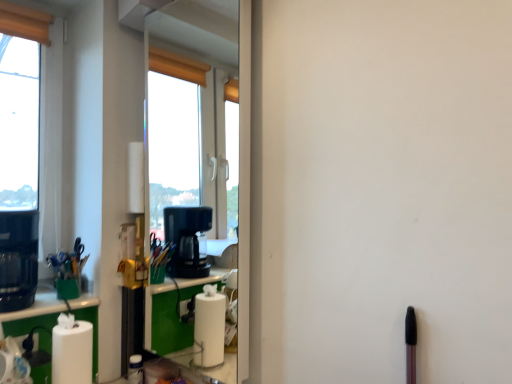
Image resolution: width=512 pixels, height=384 pixels. I want to click on black plastic coffee machine at left, so click(18, 259).

Describe the element at coordinates (29, 152) in the screenshot. I see `white matte window at left` at that location.

Where is `green matte cup at left`? The image size is (512, 384). green matte cup at left is located at coordinates (68, 271).

Is green matte cup at left beside black plastic coffee machine at left?

No, green matte cup at left is not touching black plastic coffee machine at left.

Based on their positions, is green matte cup at left located to the left or right of black plastic coffee machine at left?

Clearly, green matte cup at left is on the right of black plastic coffee machine at left in the image.

Find the location of a particular element. The height and width of the screenshot is (384, 512). stationery that appears behind the black plastic coffee machine at left is located at coordinates (68, 271).

Relative to black plastic coffee machine at left, is green matte cup at left in front or behind?

In the image, green matte cup at left appears behind black plastic coffee machine at left.

Are black plastic coffee machine at left and green matte cup at left located far from each other?

black plastic coffee machine at left is actually quite close to green matte cup at left.

Do you think black plastic coffee machine at left is within green matte cup at left, or outside of it?

black plastic coffee machine at left is spatially situated outside green matte cup at left.

From the image's perspective, does black plastic coffee machine at left appear lower than green matte cup at left?

Incorrect, from the image's perspective, black plastic coffee machine at left is higher than green matte cup at left.

Are white matte paper towel at lower left and green matte cup at left beside each other?

No, white matte paper towel at lower left is not with green matte cup at left.

From a real-world perspective, between white matte paper towel at lower left and green matte cup at left, who is vertically higher?

In real-world perspective, green matte cup at left is above.

Would you say white matte paper towel at lower left contains green matte cup at left?

No.

In the image, there is a green matte cup at left. What are the coordinates of `paper towel below it (from a real-world perspective)` in the screenshot? It's located at pyautogui.click(x=72, y=354).

The width and height of the screenshot is (512, 384). In the image, there is a white matte window at left. In order to click on coffee machine below it (from the image's perspective) in this screenshot , I will do pos(18,259).

From a real-world perspective, is black plastic coffee machine at left positioned over white matte window at left based on gravity?

No, from a real-world perspective, black plastic coffee machine at left is not above white matte window at left.

Is black plastic coffee machine at left positioned before white matte window at left?

Yes, the depth of black plastic coffee machine at left is less than that of white matte window at left.

Who is shorter, black plastic coffee machine at left or white matte window at left?

black plastic coffee machine at left.

Which is further, (14, 275) or (63, 367)?

Point (14, 275)

Can we say black plastic coffee machine at left lies outside white matte paper towel at lower left?

Indeed, black plastic coffee machine at left is completely outside white matte paper towel at lower left.

From a real-world perspective, is black plastic coffee machine at left located higher than white matte paper towel at lower left?

Yes.

Can you confirm if black plastic coffee machine at left is smaller than white matte paper towel at lower left?

No, black plastic coffee machine at left is not smaller than white matte paper towel at lower left.

Between point (25, 196) and point (20, 220), which one is positioned in front?

The point (20, 220) is closer.

Locate an element on the screen. coffee machine on the right of white matte window at left is located at coordinates (18, 259).

Is black plastic coffee machine at left surrounded by white matte window at left?

That's incorrect, black plastic coffee machine at left is not inside white matte window at left.

Does white matte window at left turn towards black plastic coffee machine at left?

Yes, white matte window at left is turned towards black plastic coffee machine at left.

Could white matte window at left be considered to be inside green matte cup at left?

No, green matte cup at left does not contain white matte window at left.

From the picture: From a real-world perspective, is green matte cup at left physically below white matte window at left?

Yes, from a real-world perspective, green matte cup at left is below white matte window at left.

Between green matte cup at left and white matte window at left, which one is positioned behind?

white matte window at left is more distant.

Identify the location of coffee machine above the green matte cup at left (from the image's perspective). Image resolution: width=512 pixels, height=384 pixels. (18, 259).

Locate an element on the screen. The width and height of the screenshot is (512, 384). stationery located on the right of black plastic coffee machine at left is located at coordinates (68, 271).

When comparing their distances from white matte paper towel at lower left, does black plastic coffee machine at left or green matte cup at left seem further?

black plastic coffee machine at left is positioned further to the anchor white matte paper towel at lower left.

Estimate the real-world distances between objects in this image. Which object is closer to green matte cup at left, black plastic coffee machine at left or white matte paper towel at lower left?

black plastic coffee machine at left is positioned closer to the anchor green matte cup at left.

Which object lies nearer to the anchor point green matte cup at left, white matte window at left or white matte paper towel at lower left?

white matte paper towel at lower left is positioned closer to the anchor green matte cup at left.

Based on their spatial positions, is green matte cup at left or white matte window at left further from black plastic coffee machine at left?

white matte window at left.

Based on their spatial positions, is white matte paper towel at lower left or black plastic coffee machine at left further from white matte window at left?

Among the two, white matte paper towel at lower left is located further to white matte window at left.

Based on their spatial positions, is black plastic coffee machine at left or white matte paper towel at lower left further from white matte window at left?

white matte paper towel at lower left lies further to white matte window at left than the other object.

When comparing their distances from white matte paper towel at lower left, does black plastic coffee machine at left or white matte window at left seem further?

white matte window at left is further to white matte paper towel at lower left.

Based on their spatial positions, is black plastic coffee machine at left or white matte window at left further from green matte cup at left?

Among the two, white matte window at left is located further to green matte cup at left.

This screenshot has height=384, width=512. Find the location of `coffee machine between white matte window at left and white matte paper towel at lower left from top to bottom`. coffee machine between white matte window at left and white matte paper towel at lower left from top to bottom is located at coordinates (18, 259).

Where is `stationery between black plastic coffee machine at left and white matte paper towel at lower left in the vertical direction`? stationery between black plastic coffee machine at left and white matte paper towel at lower left in the vertical direction is located at coordinates (68, 271).

The image size is (512, 384). Identify the location of stationery between white matte window at left and white matte paper towel at lower left vertically. (68, 271).

The image size is (512, 384). Find the location of `coffee machine between white matte window at left and green matte cup at left from top to bottom`. coffee machine between white matte window at left and green matte cup at left from top to bottom is located at coordinates (18, 259).